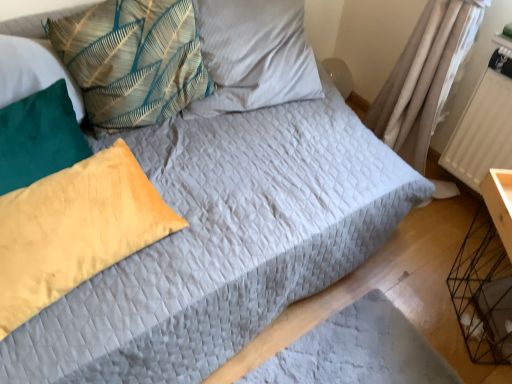
Question: From a real-world perspective, is teal fabric pillow at upper left, which is counted as the 2th pillow, starting from the top, positioned over yellow cotton pillow at left, positioned as the 2th pillow in bottom-to-top order, based on gravity?

Choices:
 (A) no
 (B) yes

Answer: (B)

Question: Does teal fabric pillow at upper left, which is counted as the 2th pillow, starting from the top, come behind yellow cotton pillow at left, positioned as the 2th pillow in bottom-to-top order?

Choices:
 (A) yes
 (B) no

Answer: (A)

Question: Is teal fabric pillow at upper left, the third pillow when ordered from bottom to top, located outside yellow cotton pillow at left, the third pillow positioned from the top?

Choices:
 (A) no
 (B) yes

Answer: (B)

Question: Is teal fabric pillow at upper left, the third pillow when ordered from bottom to top, at the right side of yellow cotton pillow at left, positioned as the 2th pillow in bottom-to-top order?

Choices:
 (A) no
 (B) yes

Answer: (B)

Question: Is teal fabric pillow at upper left, which is counted as the 2th pillow, starting from the top, positioned with its back to yellow cotton pillow at left, positioned as the 2th pillow in bottom-to-top order?

Choices:
 (A) yes
 (B) no

Answer: (B)

Question: Are teal fabric pillow at upper left, which is counted as the 2th pillow, starting from the top, and yellow cotton pillow at left, positioned as the 2th pillow in bottom-to-top order, located far from each other?

Choices:
 (A) yes
 (B) no

Answer: (B)

Question: Is velvet yellow pillow at left, the 1th pillow ordered from the bottom, surrounded by white textured radiator at right?

Choices:
 (A) no
 (B) yes

Answer: (A)

Question: Is white textured radiator at right completely or partially outside of velvet yellow pillow at left, the 4th pillow when ordered from top to bottom?

Choices:
 (A) yes
 (B) no

Answer: (A)

Question: From a real-world perspective, is white textured radiator at right positioned over velvet yellow pillow at left, the 1th pillow ordered from the bottom, based on gravity?

Choices:
 (A) no
 (B) yes

Answer: (A)

Question: Is there a large distance between white textured radiator at right and velvet yellow pillow at left, the 4th pillow when ordered from top to bottom?

Choices:
 (A) yes
 (B) no

Answer: (A)

Question: Is white textured radiator at right closer to camera compared to velvet yellow pillow at left, the 4th pillow when ordered from top to bottom?

Choices:
 (A) yes
 (B) no

Answer: (B)

Question: Is white textured radiator at right directly adjacent to velvet yellow pillow at left, the 1th pillow ordered from the bottom?

Choices:
 (A) no
 (B) yes

Answer: (A)

Question: Considering the relative sizes of textured fabric pillow at upper center, the first pillow from the top, and teal fabric pillow at upper left, which is counted as the 2th pillow, starting from the top, in the image provided, is textured fabric pillow at upper center, the first pillow from the top, smaller than teal fabric pillow at upper left, which is counted as the 2th pillow, starting from the top,?

Choices:
 (A) yes
 (B) no

Answer: (B)